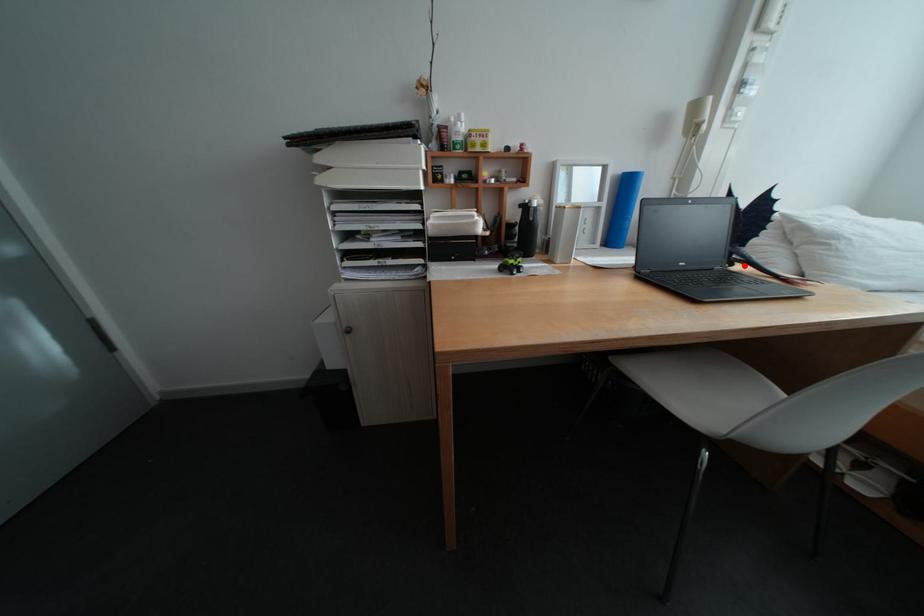
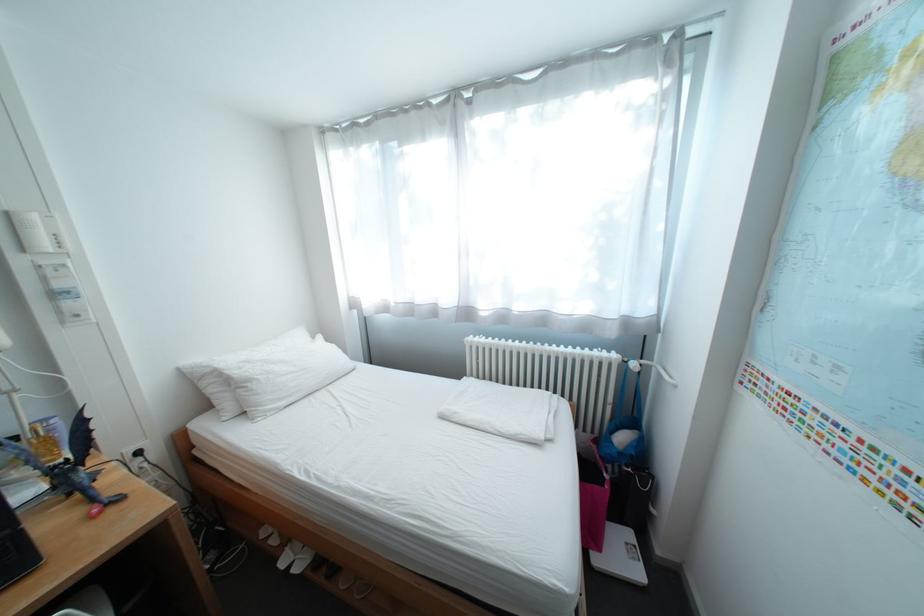
Find the pixel in the second image that matches the highlighted location in the first image.

(81, 495)